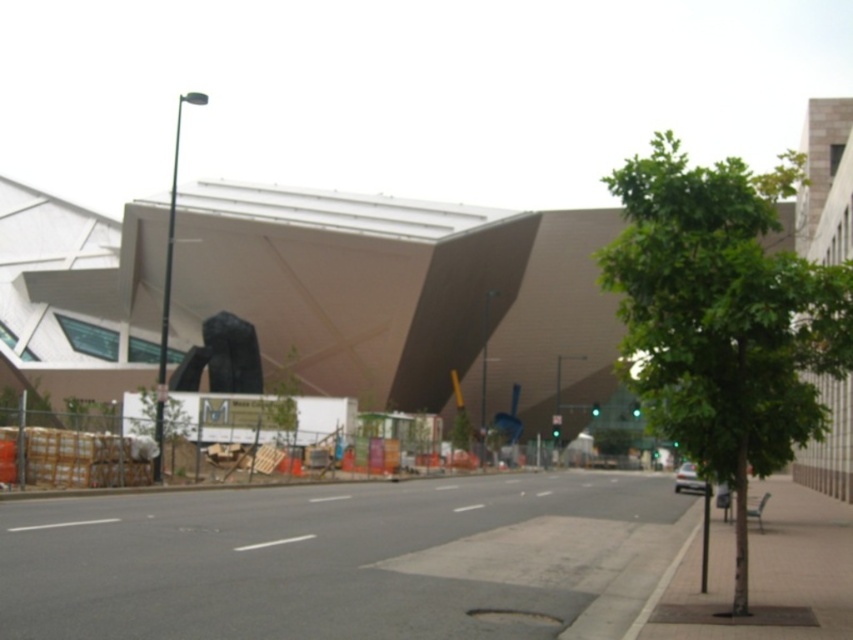
Question: Which point appears closest to the camera in this image?

Choices:
 (A) (749, 189)
 (B) (28, 348)

Answer: (A)

Question: Among these points, which one is nearest to the camera?

Choices:
 (A) (450, 291)
 (B) (770, 285)

Answer: (B)

Question: Is smooth concrete building at center in front of green leafy tree at right?

Choices:
 (A) yes
 (B) no

Answer: (B)

Question: Does smooth concrete building at center have a larger size compared to green leafy tree at right?

Choices:
 (A) yes
 (B) no

Answer: (B)

Question: Is smooth concrete building at center bigger than green leafy tree at right?

Choices:
 (A) no
 (B) yes

Answer: (A)